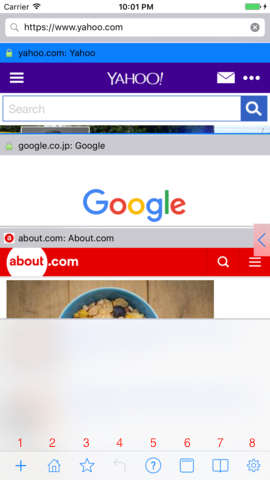
I want to click on setting bar, so click(254, 80).